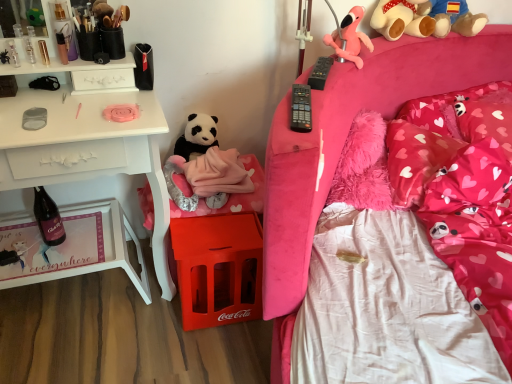
You are a GUI agent. You are given a task and a screenshot of the screen. Output one action in this format:
    pyautogui.click(x=<x>, y=<y>)
    Task: Click on the black plastic remote control at upper right, which appears as the first remote control when ordered from the bottom
    The width and height of the screenshot is (512, 384).
    Given the screenshot: What is the action you would take?
    pyautogui.click(x=301, y=108)

What do you see at coordinates (29, 49) in the screenshot? Image resolution: width=512 pixels, height=384 pixels. I see `clear plastic bottles at upper left, the first toiletry positioned from the left` at bounding box center [29, 49].

The height and width of the screenshot is (384, 512). Find the location of `pink fluffy pillow at upper right, arranged as the third pillow when viewed from the right`. pink fluffy pillow at upper right, arranged as the third pillow when viewed from the right is located at coordinates (416, 160).

What do you see at coordinates (320, 73) in the screenshot? I see `black plastic remote control at upper right, which ranks as the 2th remote control in bottom-to-top order` at bounding box center [320, 73].

What do you see at coordinates (104, 248) in the screenshot?
I see `shiny white tray at lower left` at bounding box center [104, 248].

The width and height of the screenshot is (512, 384). What do you see at coordinates (62, 48) in the screenshot?
I see `translucent plastic lip balm at upper left, placed as the 1th toiletry when sorted from right to left` at bounding box center [62, 48].

This screenshot has width=512, height=384. I want to click on black plastic remote control at upper right, acting as the 2th remote control starting from the top, so click(301, 108).

Is pink fluffy pillow at upper right, arranged as the third pillow when viewed from the right, at the back of metallic gold lip balm at upper left, positioned as the second toiletry in left-to-right order?

No, pink fluffy pillow at upper right, arranged as the third pillow when viewed from the right, is not at the back of metallic gold lip balm at upper left, positioned as the second toiletry in left-to-right order.

Does metallic gold lip balm at upper left, positioned as the second toiletry in left-to-right order, have a lesser height compared to pink fluffy pillow at upper right, arranged as the third pillow when viewed from the right?

Yes, metallic gold lip balm at upper left, positioned as the second toiletry in left-to-right order, is shorter than pink fluffy pillow at upper right, arranged as the third pillow when viewed from the right.

From the image's perspective, is metallic gold lip balm at upper left, arranged as the second toiletry when viewed from the right, positioned above or below pink fluffy pillow at upper right, arranged as the third pillow when viewed from the right?

From the image's perspective, metallic gold lip balm at upper left, arranged as the second toiletry when viewed from the right, appears above pink fluffy pillow at upper right, arranged as the third pillow when viewed from the right.

Is pink fluffy pillow at upper right, arranged as the 2th pillow when viewed from the left, outside of metallic gold lip balm at upper left, arranged as the second toiletry when viewed from the right?

That's correct, pink fluffy pillow at upper right, arranged as the 2th pillow when viewed from the left, is outside of metallic gold lip balm at upper left, arranged as the second toiletry when viewed from the right.

Between pink fluffy pillow at upper right, which ranks as the second pillow in right-to-left order, and metallic gold lip balm at upper left, positioned as the second toiletry in left-to-right order, which one appears on the left side from the viewer's perspective?

Positioned to the left is metallic gold lip balm at upper left, positioned as the second toiletry in left-to-right order.

Can you confirm if pink fluffy pillow at upper right, which ranks as the second pillow in right-to-left order, is shorter than metallic gold lip balm at upper left, positioned as the second toiletry in left-to-right order?

In fact, pink fluffy pillow at upper right, which ranks as the second pillow in right-to-left order, may be taller than metallic gold lip balm at upper left, positioned as the second toiletry in left-to-right order.

From the image's perspective, is pink fluffy pillow at upper right, arranged as the 2th pillow when viewed from the left, on metallic gold lip balm at upper left, positioned as the second toiletry in left-to-right order?

No, from the image's perspective, pink fluffy pillow at upper right, arranged as the 2th pillow when viewed from the left, is not over metallic gold lip balm at upper left, positioned as the second toiletry in left-to-right order.

How distant is pink plush teddy bear at upper right, the 1th teddy bear when ordered from right to left, from brown plush teddy bear at upper right?

4.54 inches.

Is pink plush teddy bear at upper right, which is the third teddy bear in left-to-right order, smaller than brown plush teddy bear at upper right?

Yes, pink plush teddy bear at upper right, which is the third teddy bear in left-to-right order, is smaller than brown plush teddy bear at upper right.

Which object is positioned more to the right, pink plush teddy bear at upper right, which is the third teddy bear in left-to-right order, or brown plush teddy bear at upper right?

From the viewer's perspective, brown plush teddy bear at upper right appears more on the right side.

Which is further, (x=428, y=23) or (x=477, y=30)?

The point (x=477, y=30) is more distant.

In the scene shown: Visually, is pink fluffy pillow at upper right, arranged as the 2th pillow when viewed from the left, positioned to the left or to the right of clear plastic bottles at upper left, the first toiletry positioned from the left?

In the image, pink fluffy pillow at upper right, arranged as the 2th pillow when viewed from the left, appears on the right side of clear plastic bottles at upper left, the first toiletry positioned from the left.

Is pink fluffy pillow at upper right, which ranks as the second pillow in right-to-left order, inside or outside of clear plastic bottles at upper left, the 3th toiletry when ordered from right to left?

pink fluffy pillow at upper right, which ranks as the second pillow in right-to-left order, is not enclosed by clear plastic bottles at upper left, the 3th toiletry when ordered from right to left.

Looking at this image, are pink fluffy pillow at upper right, arranged as the 2th pillow when viewed from the left, and clear plastic bottles at upper left, the 3th toiletry when ordered from right to left, making contact?

No, pink fluffy pillow at upper right, arranged as the 2th pillow when viewed from the left, is not touching clear plastic bottles at upper left, the 3th toiletry when ordered from right to left.

Who is shorter, pink fluffy pillow at upper right, arranged as the 2th pillow when viewed from the left, or clear plastic bottles at upper left, the first toiletry positioned from the left?

clear plastic bottles at upper left, the first toiletry positioned from the left, is shorter.

Could black plastic remote control at upper right, positioned as the first remote control in top-to-bottom order, be considered to be inside pink fluffy pillow at upper right, which ranks as the second pillow in right-to-left order?

That's incorrect, black plastic remote control at upper right, positioned as the first remote control in top-to-bottom order, is not inside pink fluffy pillow at upper right, which ranks as the second pillow in right-to-left order.

Consider the image. Measure the distance between pink fluffy pillow at upper right, arranged as the 2th pillow when viewed from the left, and black plastic remote control at upper right, positioned as the first remote control in back-to-front order.

Answer: 27.80 inches.

From a real-world perspective, between pink fluffy pillow at upper right, arranged as the 2th pillow when viewed from the left, and black plastic remote control at upper right, acting as the 1th remote control starting from the right, who is vertically lower?

pink fluffy pillow at upper right, arranged as the 2th pillow when viewed from the left.

From the image's perspective, does pink fluffy pillow at upper right, arranged as the 2th pillow when viewed from the left, appear lower than black plastic remote control at upper right, positioned as the first remote control in back-to-front order?

Correct, pink fluffy pillow at upper right, arranged as the 2th pillow when viewed from the left, appears lower than black plastic remote control at upper right, positioned as the first remote control in back-to-front order, in the image.

Which of these two, pink plush toy at upper right, the 2th teddy bear from the top, or matte glass bottle at lower left, is thinner?

Thinner between the two is matte glass bottle at lower left.

How distant is pink plush toy at upper right, the second teddy bear when ordered from right to left, from matte glass bottle at lower left?

pink plush toy at upper right, the second teddy bear when ordered from right to left, is 1.16 meters away from matte glass bottle at lower left.

Is pink plush toy at upper right, the 2th teddy bear from the top, looking in the opposite direction of matte glass bottle at lower left?

No, pink plush toy at upper right, the 2th teddy bear from the top, is not facing the opposite direction of matte glass bottle at lower left.

Based on the photo, between pink plush toy at upper right, acting as the second teddy bear starting from the bottom, and matte glass bottle at lower left, which one has less height?

With less height is pink plush toy at upper right, acting as the second teddy bear starting from the bottom.

From a real-world perspective, which is physically above, red plastic crate at lower center or brown plush teddy bear at upper right?

brown plush teddy bear at upper right, from a real-world perspective.

Which point is more distant from viewer, (x=225, y=265) or (x=481, y=28)?

The point (x=481, y=28) is farther from the camera.

Identify the location of crate directly beneath the brown plush teddy bear at upper right (from a real-world perspective). (218, 268).

In order to click on pillow that is the 3rd one when counting downward from the metallic gold lip balm at upper left, positioned as the second toiletry in left-to-right order (from the image's perspective) in this screenshot , I will do `click(416, 160)`.

Locate an element on the screen. This screenshot has height=384, width=512. the 1st pillow located beneath the metallic gold lip balm at upper left, arranged as the second toiletry when viewed from the right (from a real-world perspective) is located at coordinates (445, 107).

Which object lies further to the anchor point pink fluffy pillow at upper right, which ranks as the second pillow in right-to-left order, black plastic remote control at upper right, which appears as the first remote control when ordered from the bottom, or translucent plastic lip balm at upper left, placed as the 1th toiletry when sorted from right to left?

The object further to pink fluffy pillow at upper right, which ranks as the second pillow in right-to-left order, is translucent plastic lip balm at upper left, placed as the 1th toiletry when sorted from right to left.

When comparing their distances from metallic gold lip balm at upper left, positioned as the second toiletry in left-to-right order, does pink fluffy pillow at upper right, arranged as the third pillow when viewed from the right, or clear plastic bottles at upper left, the first toiletry positioned from the left, seem further?

pink fluffy pillow at upper right, arranged as the third pillow when viewed from the right, lies further to metallic gold lip balm at upper left, positioned as the second toiletry in left-to-right order, than the other object.

From the image, which object appears to be nearer to black plush teddy bear at center, which appears as the first teddy bear when ordered from the bottom, pink plush teddy bear at upper right, which is the third teddy bear in left-to-right order, or clear plastic bottles at upper left, the first toiletry positioned from the left?

clear plastic bottles at upper left, the first toiletry positioned from the left.

From the image, which object appears to be nearer to pink fluffy pillow at upper right, arranged as the third pillow when viewed from the right, pink fluffy pillow at upper right, which ranks as the second pillow in right-to-left order, or black plastic remote control at upper right, which ranks as the 2th remote control in bottom-to-top order?

Based on the image, pink fluffy pillow at upper right, which ranks as the second pillow in right-to-left order, appears to be nearer to pink fluffy pillow at upper right, arranged as the third pillow when viewed from the right.

When comparing their distances from shiny white tray at lower left, does pink plush toy at upper right, the 2th teddy bear from the top, or translucent plastic lip balm at upper left, the third toiletry positioned from the left, seem closer?

Based on the image, translucent plastic lip balm at upper left, the third toiletry positioned from the left, appears to be nearer to shiny white tray at lower left.

Estimate the real-world distances between objects in this image. Which object is further from clear plastic bottles at upper left, the 3th toiletry when ordered from right to left, pink fluffy pillow at upper right, the 3th pillow in the left-to-right sequence, or brown plush teddy bear at upper right?

pink fluffy pillow at upper right, the 3th pillow in the left-to-right sequence, is positioned further to the anchor clear plastic bottles at upper left, the 3th toiletry when ordered from right to left.

Considering their positions, is brown plush teddy bear at upper right positioned further to black plastic remote control at upper right, positioned as the first remote control in back-to-front order, than pink fluffy pillow at upper right, placed as the 1th pillow when sorted from right to left?

pink fluffy pillow at upper right, placed as the 1th pillow when sorted from right to left, is further to black plastic remote control at upper right, positioned as the first remote control in back-to-front order.

From the image, which object appears to be farther from pink plush toy at upper right, positioned as the second teddy bear in left-to-right order, pink fluffy pillow at upper right, which ranks as the second pillow in right-to-left order, or shiny white tray at lower left?

shiny white tray at lower left is positioned further to the anchor pink plush toy at upper right, positioned as the second teddy bear in left-to-right order.

Find the location of `pillow between translucent plastic lip balm at upper left, the third toiletry positioned from the left, and pink fluffy pillow at upper right, arranged as the 2th pillow when viewed from the left`. pillow between translucent plastic lip balm at upper left, the third toiletry positioned from the left, and pink fluffy pillow at upper right, arranged as the 2th pillow when viewed from the left is located at coordinates (416, 160).

Locate an element on the screen. The image size is (512, 384). toy situated between translucent plastic lip balm at upper left, placed as the 1th toiletry when sorted from right to left, and pink fluffy pillow at upper right, which ranks as the second pillow in right-to-left order, from left to right is located at coordinates (455, 18).

The width and height of the screenshot is (512, 384). Identify the location of teddy bear between shiny white tray at lower left and black plastic remote control at upper right, acting as the 1th remote control starting from the right. (197, 136).

The image size is (512, 384). I want to click on bottle that lies between clear plastic bottles at upper left, the 3th toiletry when ordered from right to left, and red plastic crate at lower center from top to bottom, so click(x=48, y=218).